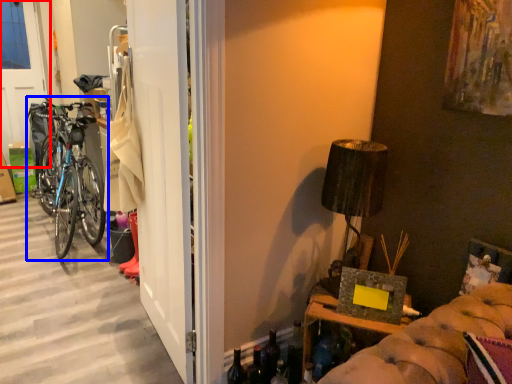
Question: Which object appears farthest to the camera in this image, screen door (highlighted by a red box) or bicycle (highlighted by a blue box)?

Choices:
 (A) screen door
 (B) bicycle

Answer: (A)